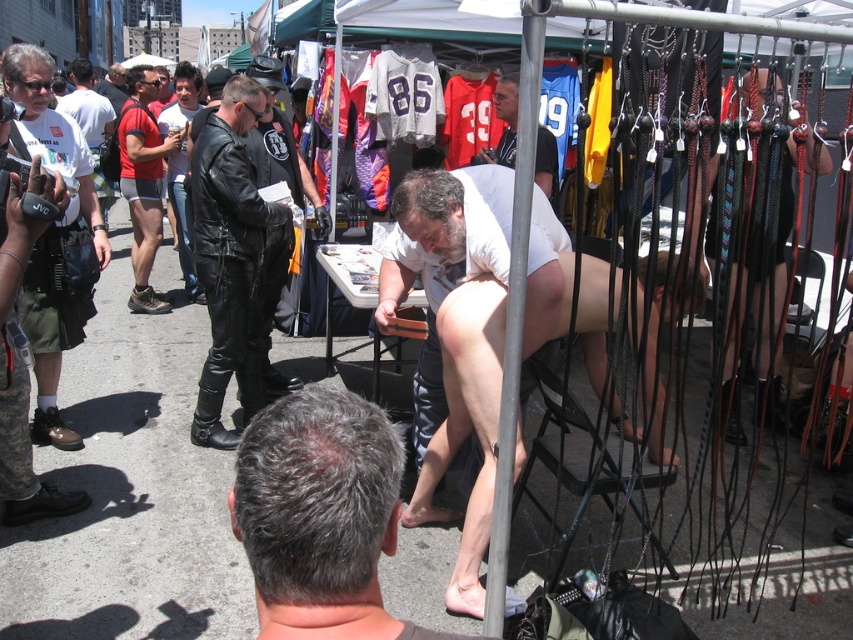
You are a photographer at the market and want to capture both the gray hair at center and the white jersey at upper center in the same frame. Based on their positions, which object is closer to the camera?

The gray hair at center is positioned under the white jersey at upper center, meaning the gray hair at center is closer to the camera than the white jersey at upper center.